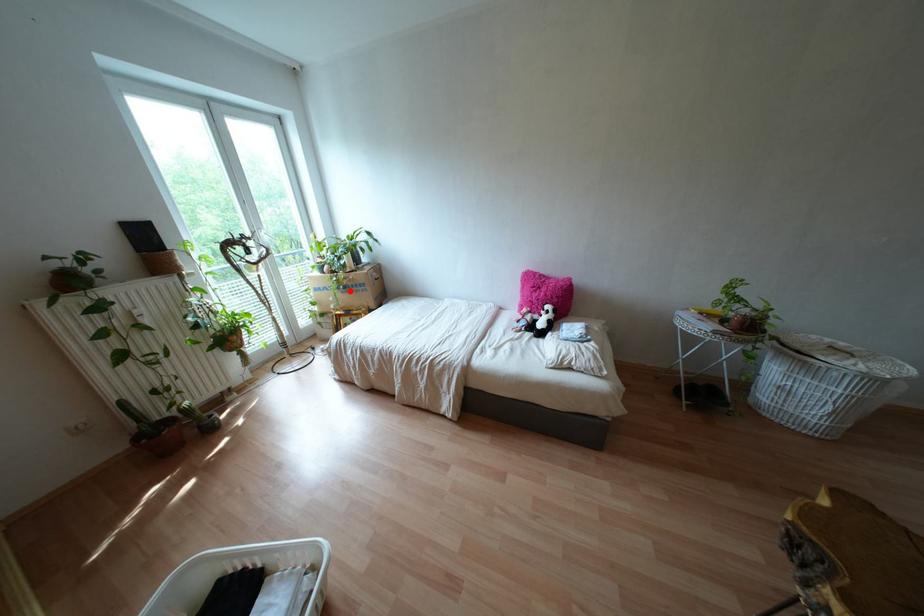
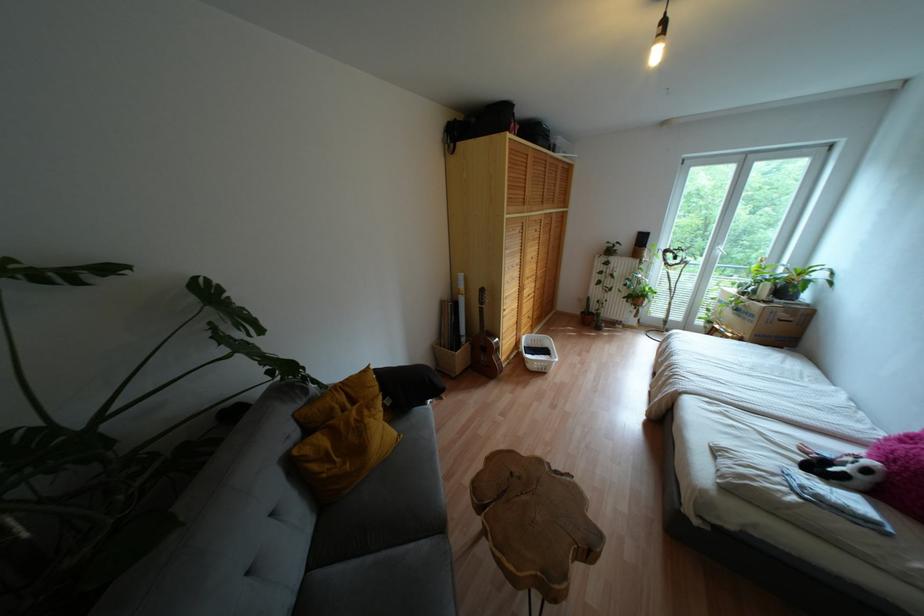
Question: A red point is marked in image1. In image2, is the corresponding 3D point closer to the camera or farther? Reply with the corresponding letter.

Choices:
 (A) The corresponding 3D point is closer.
 (B) The corresponding 3D point is farther.

Answer: (B)